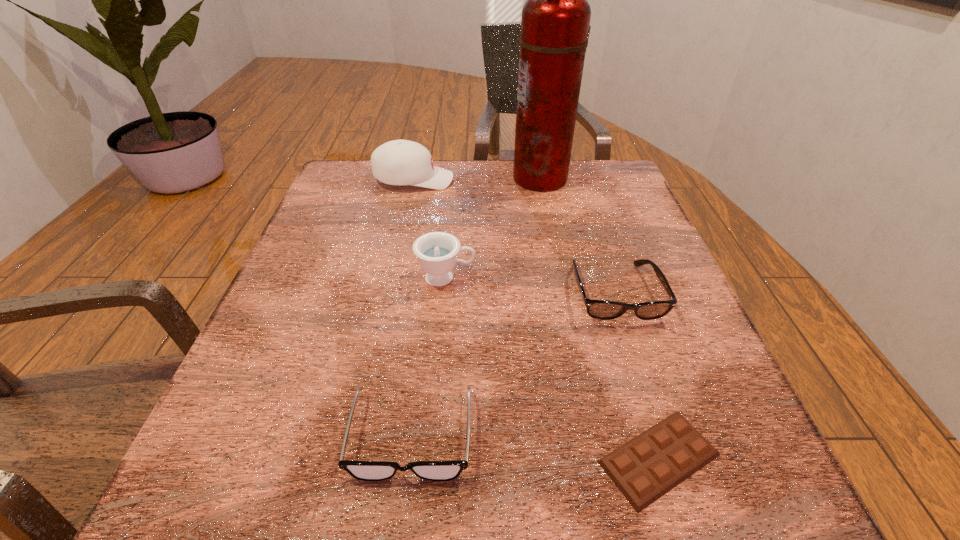
Where is `free space between the chocolate bar and the third tallest object`? Image resolution: width=960 pixels, height=540 pixels. free space between the chocolate bar and the third tallest object is located at coordinates (553, 368).

Locate an element on the screen. free space between the fifth tallest object and the fifth shortest object is located at coordinates (413, 308).

Locate an element on the screen. vacant area between the taller spectacles and the baseball cap is located at coordinates coord(515,237).

You are a GUI agent. You are given a task and a screenshot of the screen. Output one action in this format:
    pyautogui.click(x=<x>, y=<y>)
    Task: Click on the unoccupied area between the tallest object and the fourth shortest object
    This screenshot has width=960, height=540.
    Given the screenshot: What is the action you would take?
    pyautogui.click(x=492, y=228)

Locate which object ranks third in proximity to the nearer spectacles. Please provide its 2D coordinates. Your answer should be formatted as a tuple, i.e. [(x, y)], where the tuple contains the x and y coordinates of a point satisfying the conditions above.

[(598, 309)]

Locate an element on the screen. The width and height of the screenshot is (960, 540). object that is the fourth closest to the teacup is located at coordinates 399,162.

In order to click on vacant area in the image that satisfies the following two spatial constraints: 1. on the side of the fourth shortest object with the handle; 2. on the back side of the chocolate bar in this screenshot , I will do `click(431, 458)`.

This screenshot has width=960, height=540. What are the coordinates of `vacant space that satisfies the following two spatial constraints: 1. on the side of the shortest object with the handle; 2. on the left side of the teacup` in the screenshot? It's located at (431, 458).

At what (x,y) coordinates should I click in order to perform the action: click on blank space that satisfies the following two spatial constraints: 1. on the back side of the shortest object; 2. on the front-facing side of the baseball cap. Please return your answer as a coordinate pair (x, y). This screenshot has height=540, width=960. Looking at the image, I should click on (573, 180).

Image resolution: width=960 pixels, height=540 pixels. I want to click on vacant space that satisfies the following two spatial constraints: 1. on the nozzle side of the chocolate bar; 2. on the left side of the fire extinguisher, so click(x=596, y=458).